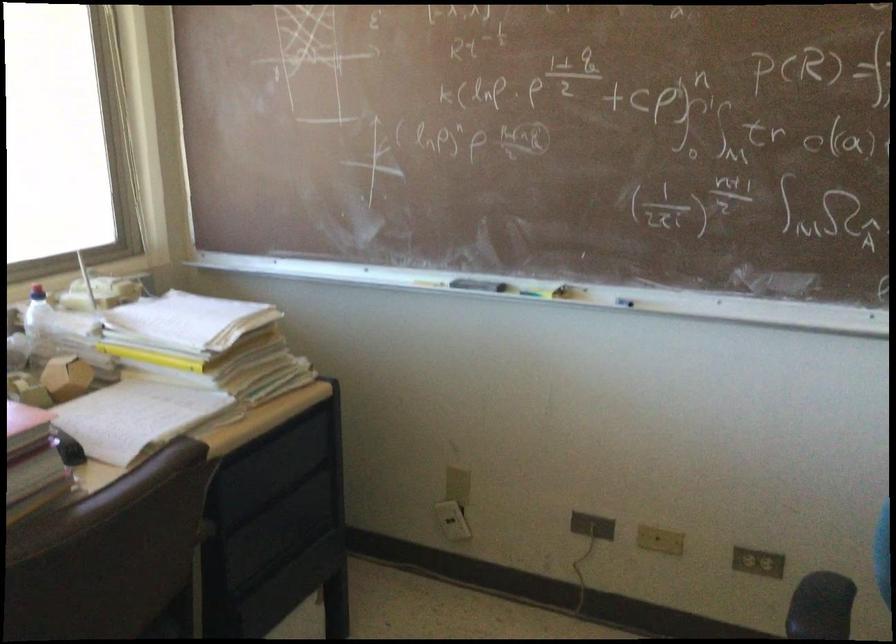
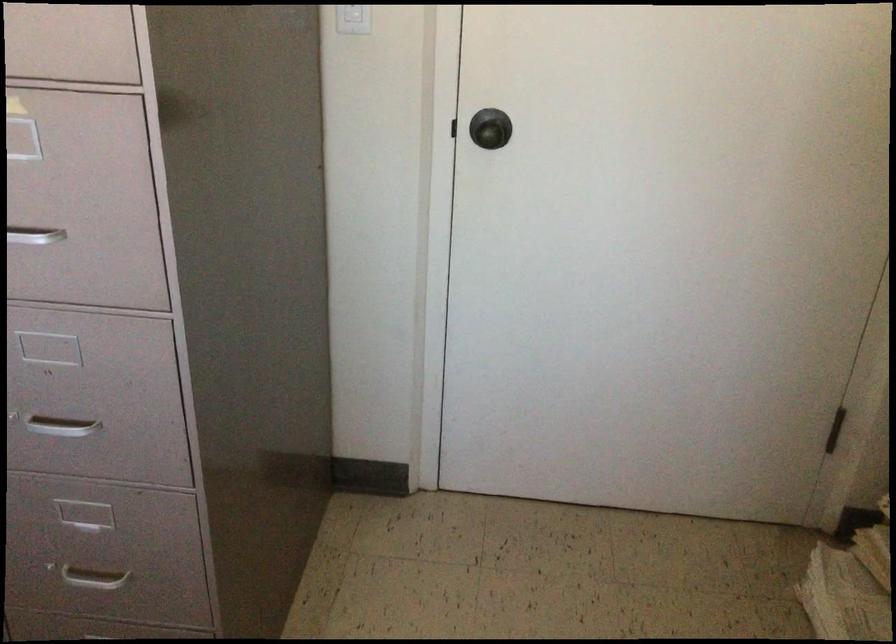
How did the camera likely rotate?

The camera rotated toward right-down.